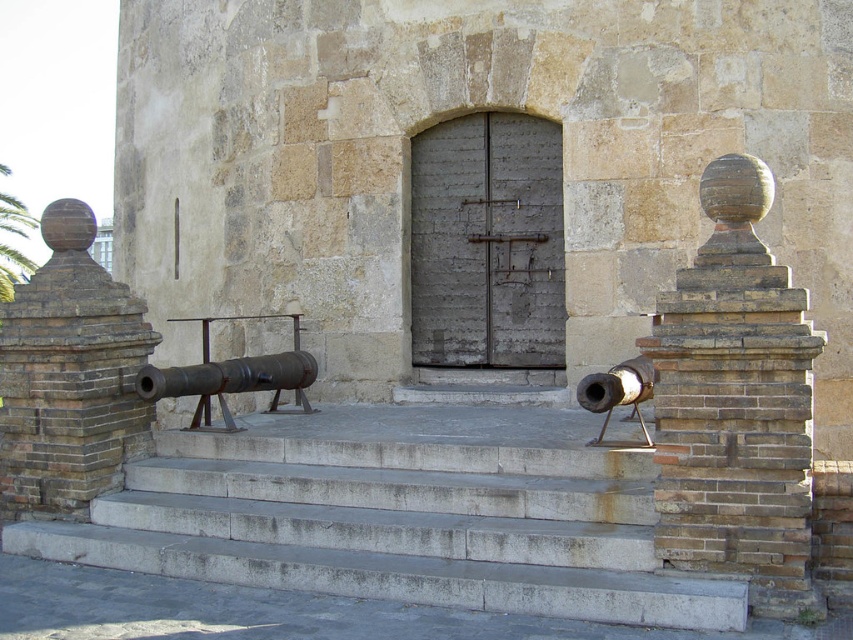
You are a visitor standing at the entrance of the historic stone structure. You notice the brown brick pillar at left and the rusty metal cannon at center. Which object is located higher up in the scene?

The brown brick pillar at left is positioned over the rusty metal cannon at center, so it is higher up in the scene.

You are a tour guide explaining the entrance to a historic site. You point out the brown brick pillar at left and the rusty metal cannon at center. Which object is closer to the visitors as they stand in front of the entrance?

The brown brick pillar at left is closer to the visitors because it is further to the viewer than the rusty metal cannon at center.